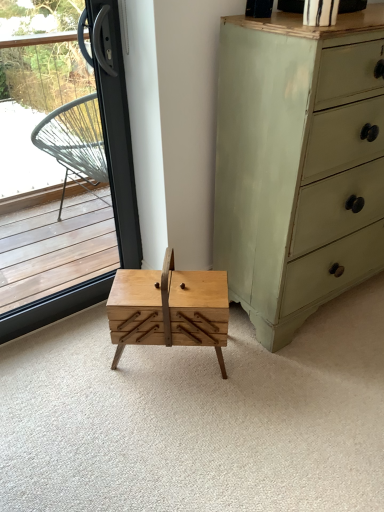
Image resolution: width=384 pixels, height=512 pixels. I want to click on free space in front of light green painted wood chest of drawers at right, so click(295, 407).